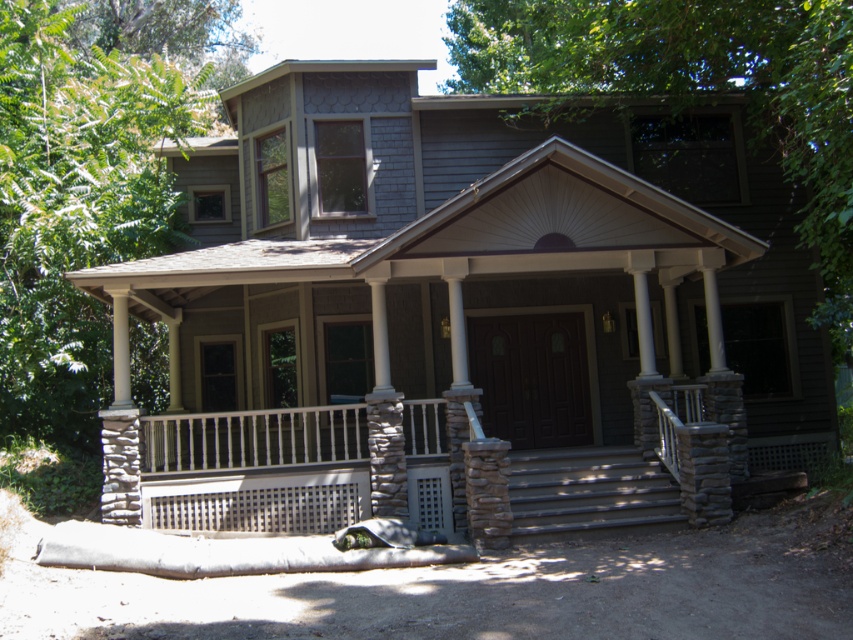
Can you confirm if stone textured porch at center is shorter than gray stone stairs at center?

Yes, stone textured porch at center is shorter than gray stone stairs at center.

Does stone textured porch at center lie in front of gray stone stairs at center?

No, it is behind gray stone stairs at center.

What do you see at coordinates (430, 468) in the screenshot? I see `stone textured porch at center` at bounding box center [430, 468].

This screenshot has height=640, width=853. What are the coordinates of `stone textured porch at center` in the screenshot? It's located at (430, 468).